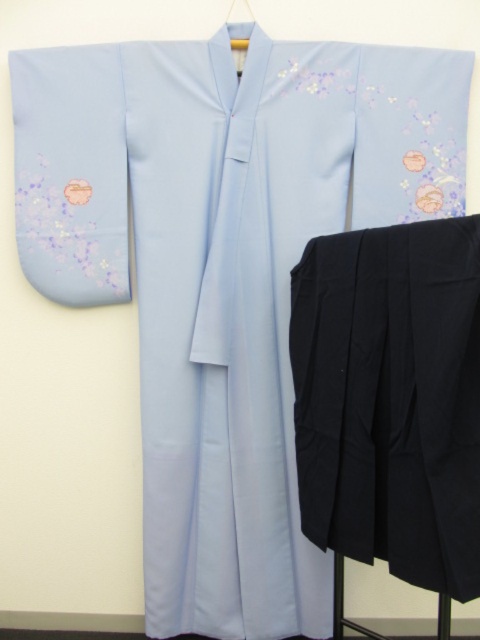
You are an interior designer arranging a display in a boutique. You need to place a decorative item between the black matte pants at lower right and the matte plastic hanger at upper center. Based on their positions, where should you place the item to ensure it is equidistant from both?

The black matte pants at lower right is to the right of the matte plastic hanger at upper center, so placing the decorative item midway between them along the horizontal axis would keep it equidistant from both.

You are a fashion designer looking to arrange these items in a photo shoot. Based on the scene, where should you place the black matte pants at lower right in relation to the matte plastic hanger at upper center to maintain the original composition?

The black matte pants at lower right should be placed below the matte plastic hanger at upper center to maintain the original composition.